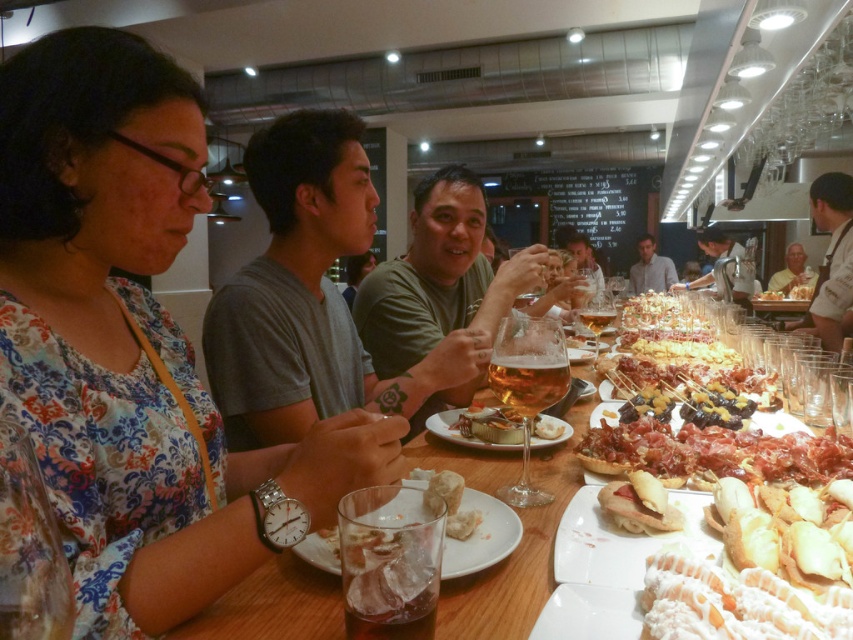
Question: Which of the following is the closest to the observer?

Choices:
 (A) white matte face at upper right
 (B) black chalkboard at upper center

Answer: (A)

Question: Does translucent glass wine at center have a lesser width compared to golden crispy bread at center?

Choices:
 (A) no
 (B) yes

Answer: (B)

Question: Estimate the real-world distances between objects in this image. Which object is closer to the slightly toasted bread at center?

Choices:
 (A) black chalkboard at upper center
 (B) metallic silver tray at upper center
 (C) white glossy plate at lower center
 (D) translucent glass wine at center

Answer: (C)

Question: Based on their relative distances, which object is nearer to the slightly toasted bread at lower right?

Choices:
 (A) metallic silver tray at upper center
 (B) light brown wooden table at center
 (C) transparent glass wine glass at lower left

Answer: (C)

Question: Is white glossy plate at lower center thinner than clear glass wine glass at center?

Choices:
 (A) yes
 (B) no

Answer: (A)

Question: Does white glossy plate at lower center appear on the left side of white uniform at right?

Choices:
 (A) yes
 (B) no

Answer: (A)